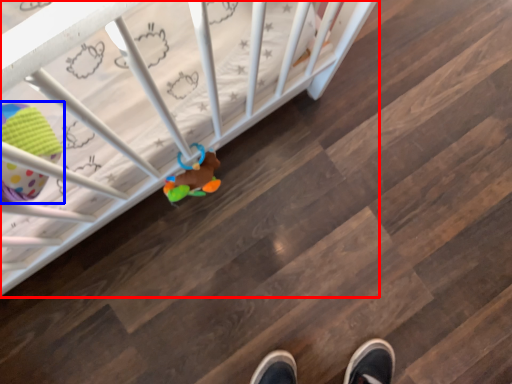
Question: Which of the following is the farthest to the observer, infant bed (highlighted by a red box) or toy (highlighted by a blue box)?

Choices:
 (A) infant bed
 (B) toy

Answer: (A)